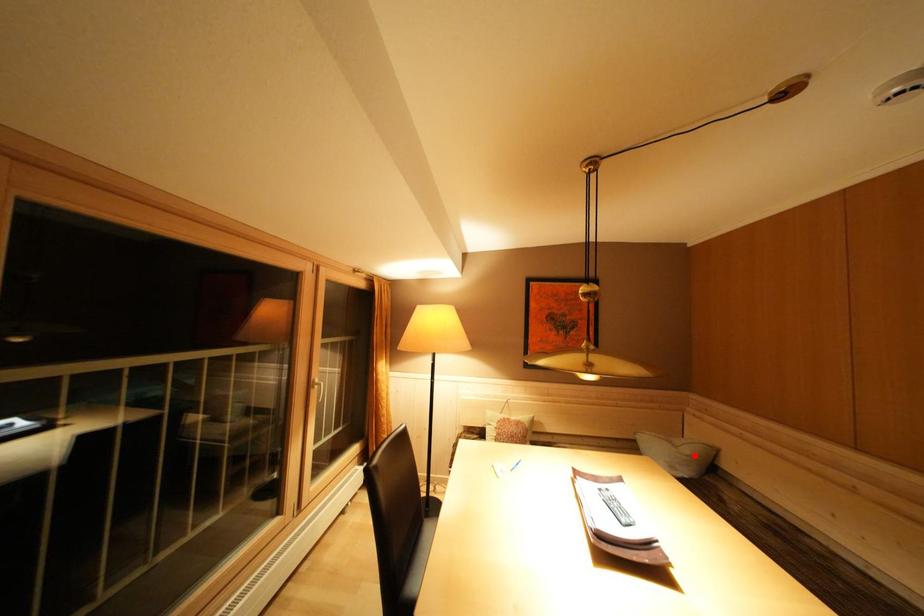
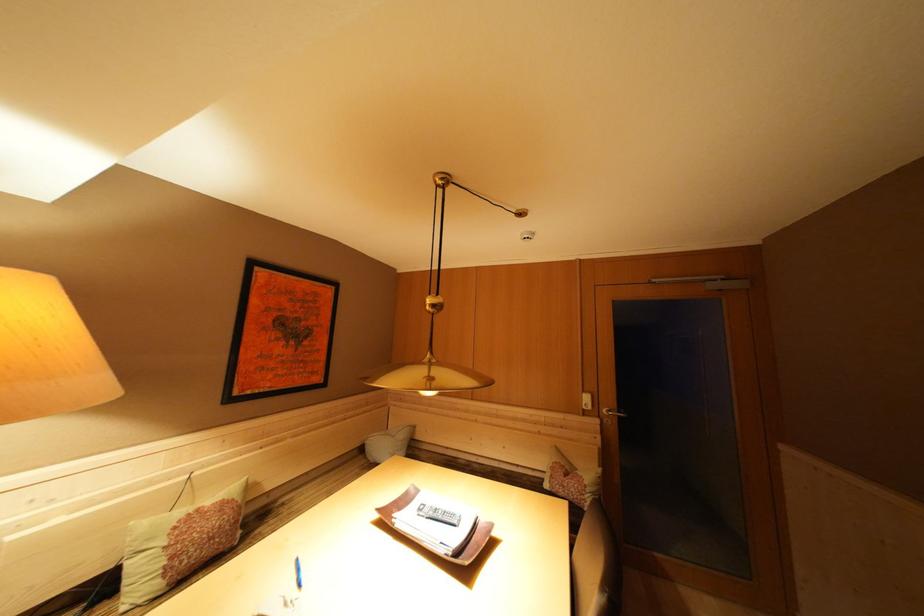
Question: I am providing you with two images of the same scene from different viewpoints. Image1 has a red point marked. In image2, the corresponding 3D location appears at what relative position? Reply with the corresponding letter.

Choices:
 (A) Closer
 (B) Farther

Answer: (B)